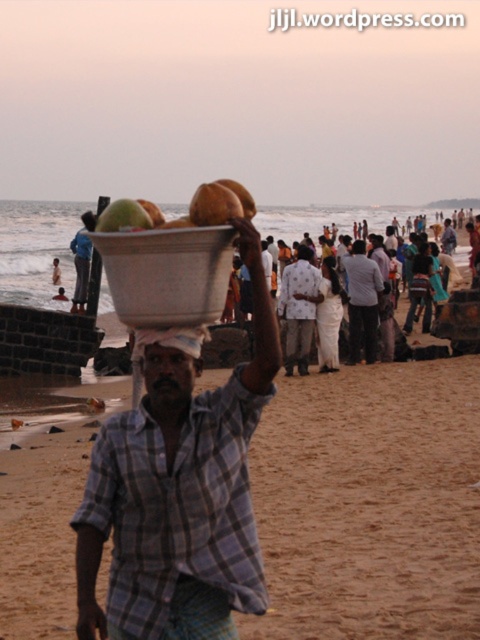
Based on the photo, is white cotton clothing at center positioned in front of printed cotton shirt at center?

No, it is not.

Who is higher up, white cotton clothing at center or printed cotton shirt at center?

white cotton clothing at center is higher up.

Locate an element on the screen. white cotton clothing at center is located at coordinates (331, 220).

Is light brown fabric shirt at center below matte white head at center?

Yes, light brown fabric shirt at center is below matte white head at center.

Which is in front, point (372, 276) or point (360, 250)?

Point (372, 276)

What are the coordinates of `light brown fabric shirt at center` in the screenshot? It's located at (361, 301).

You are a GUI agent. You are given a task and a screenshot of the screen. Output one action in this format:
    pyautogui.click(x=<x>, y=<y>)
    Task: Click on the green matte coconut at center
    The height and width of the screenshot is (640, 480).
    Given the screenshot: What is the action you would take?
    pyautogui.click(x=189, y=209)

Does point (175, 221) lie behind point (197, 224)?

Yes, point (175, 221) is behind point (197, 224).

Is point (139, 198) more distant than point (204, 212)?

That is True.

This screenshot has width=480, height=640. I want to click on green matte coconut at center, so click(189, 209).